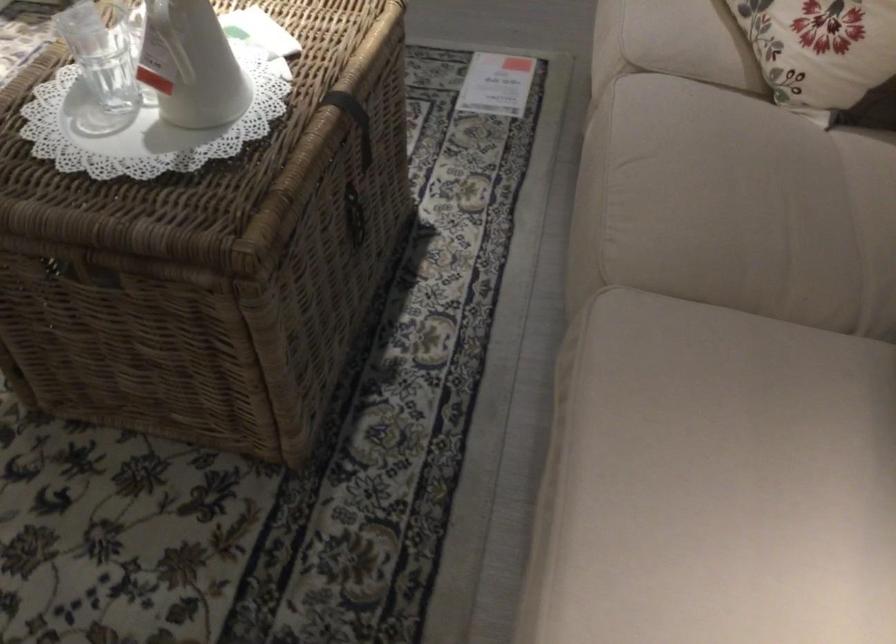
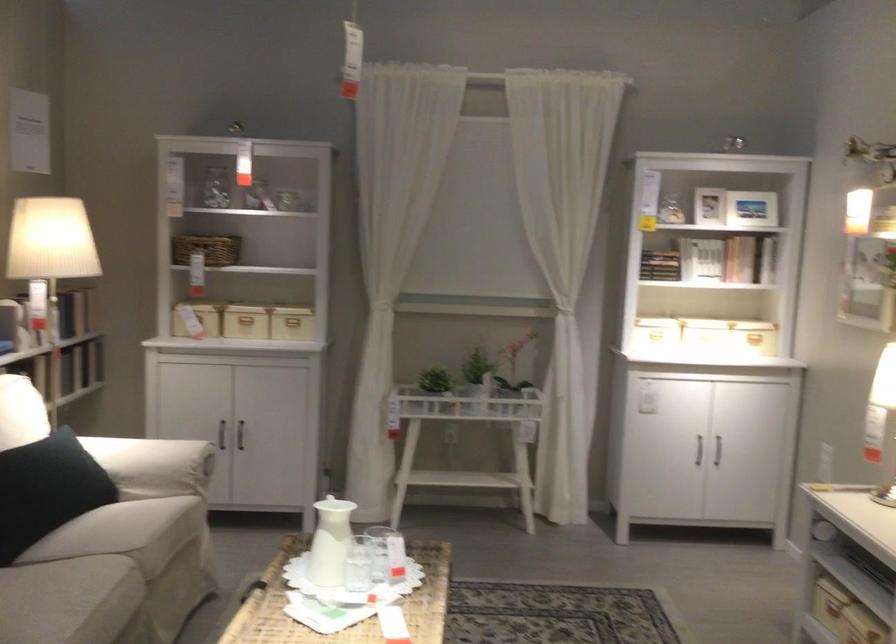
Find the pixel in the second image that matches the point at 641,236 in the first image.

(110, 576)